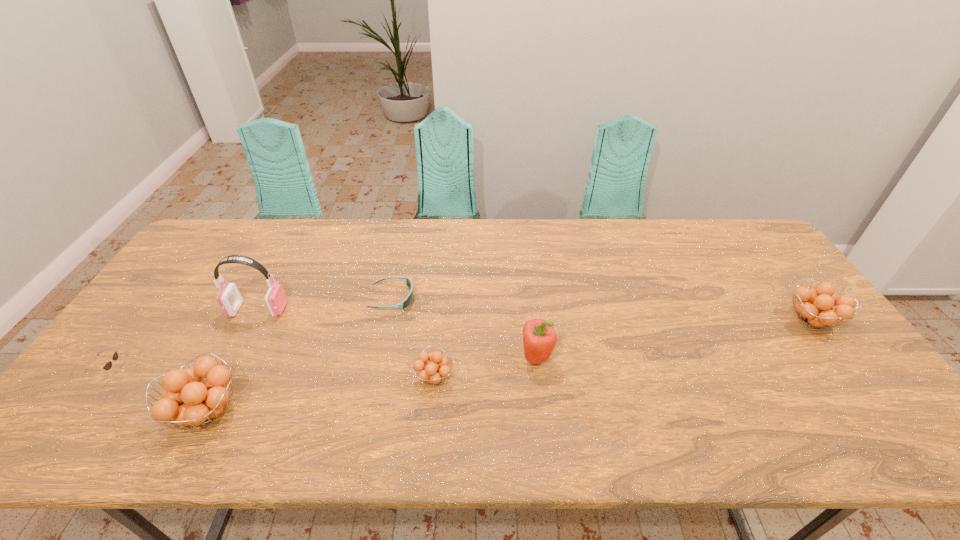
Where is `orange fruit that can be found as the closest to the shorter sunglasses`? This screenshot has height=540, width=960. orange fruit that can be found as the closest to the shorter sunglasses is located at coordinates (438, 369).

I want to click on free space that satisfies the following two spatial constraints: 1. on the outer surface of the rightmost orange fruit; 2. on the right side of the earphone, so click(x=252, y=320).

Image resolution: width=960 pixels, height=540 pixels. What are the coordinates of `blank space that satisfies the following two spatial constraints: 1. in front of the lenses of the fifth tallest object; 2. on the left side of the leftmost object` in the screenshot? It's located at (108, 377).

In order to click on vacant space that satisfies the following two spatial constraints: 1. in front of the lenses of the leftmost orange fruit; 2. on the right side of the sixth tallest object in this screenshot , I will do `click(83, 411)`.

This screenshot has width=960, height=540. Find the location of `free location that satisfies the following two spatial constraints: 1. on the back side of the pepper; 2. on the right side of the third object from right to left`. free location that satisfies the following two spatial constraints: 1. on the back side of the pepper; 2. on the right side of the third object from right to left is located at coordinates (436, 358).

The width and height of the screenshot is (960, 540). Identify the location of vacant space that satisfies the following two spatial constraints: 1. on the outer surface of the leftmost orange fruit; 2. on the right side of the earphone. pos(205,411).

I want to click on free space that satisfies the following two spatial constraints: 1. in front of the lenses of the second shortest object; 2. on the right side of the fifth tallest object, so click(108, 377).

I want to click on free space in the image that satisfies the following two spatial constraints: 1. on the front-facing side of the fourth object from right to left; 2. on the back side of the fourth shortest object, so click(x=388, y=320).

This screenshot has height=540, width=960. In order to click on free point that satisfies the following two spatial constraints: 1. in front of the lenses of the taller sunglasses; 2. on the back side of the leftmost orange fruit in this screenshot , I will do `click(83, 411)`.